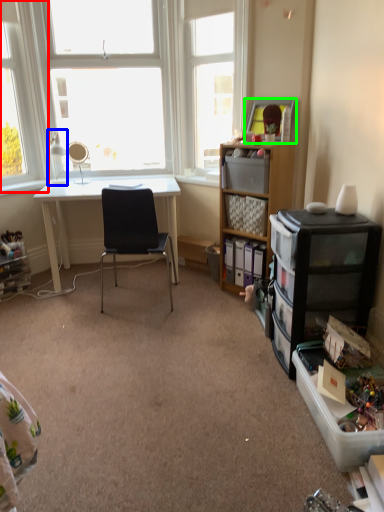
Question: Estimate the real-world distances between objects in this image. Which object is closer to window (highlighted by a red box), lamp (highlighted by a blue box) or picture frame (highlighted by a green box)?

Choices:
 (A) lamp
 (B) picture frame

Answer: (A)